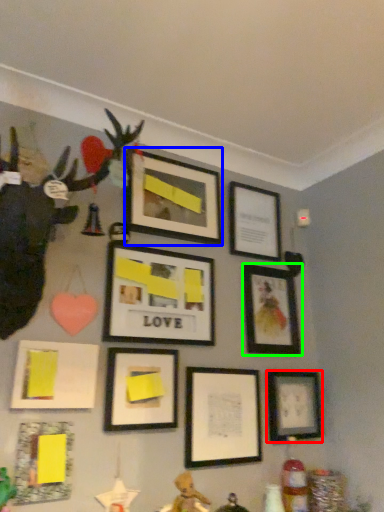
Question: Which object is the closest to the picture frame (highlighted by a red box)? Choose among these: picture frame (highlighted by a blue box) or picture frame (highlighted by a green box).

Choices:
 (A) picture frame
 (B) picture frame

Answer: (B)